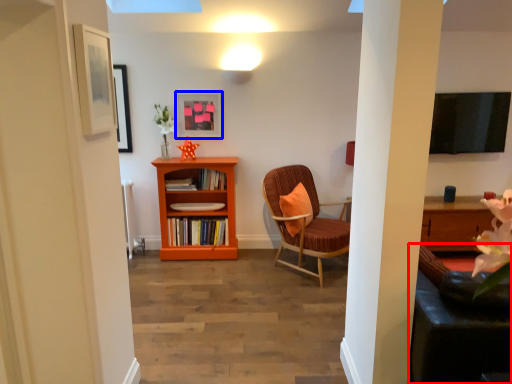
Question: Which object appears farthest to the camera in this image, swivel chair (highlighted by a red box) or picture frame (highlighted by a blue box)?

Choices:
 (A) swivel chair
 (B) picture frame

Answer: (B)